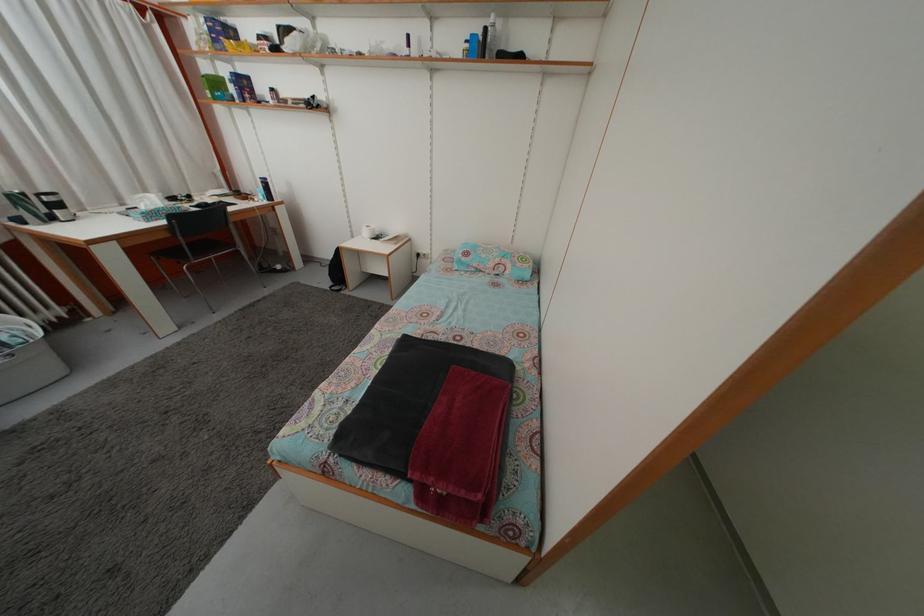
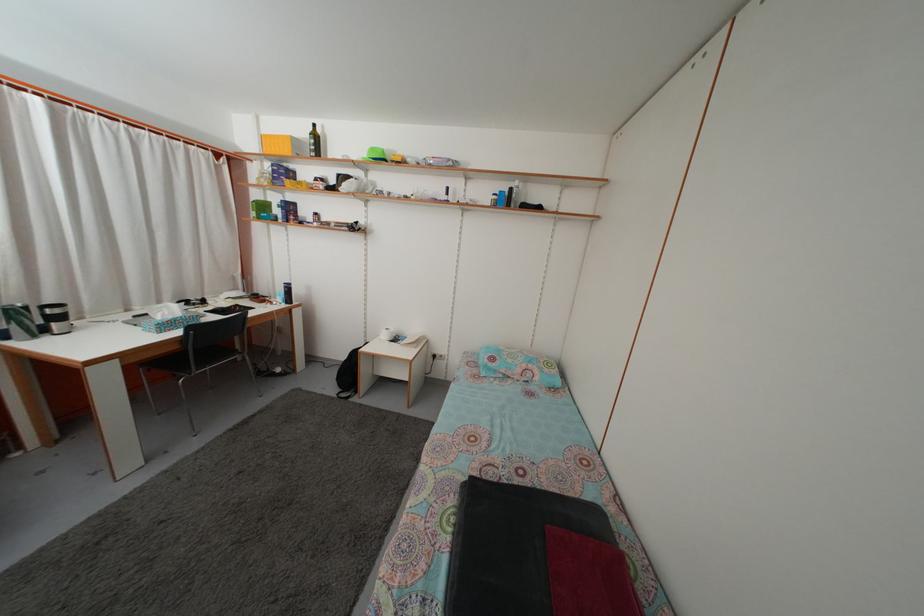
Question: What movement of the cameraman would produce the second image?

Choices:
 (A) Left
 (B) Right
 (C) Forward
 (D) Backward

Answer: (A)